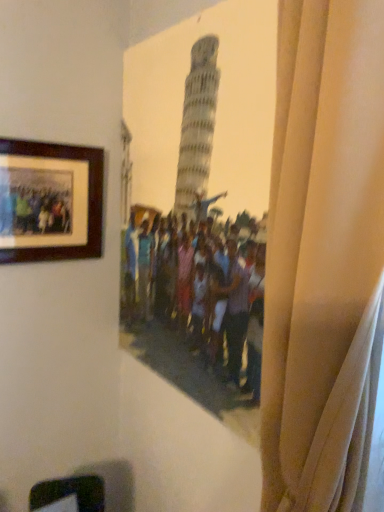
Question: Is beige fabric curtain at right inside the boundaries of wooden picture frame at upper left, or outside?

Choices:
 (A) outside
 (B) inside

Answer: (A)

Question: Looking at their shapes, would you say beige fabric curtain at right is wider or thinner than wooden picture frame at upper left?

Choices:
 (A) thin
 (B) wide

Answer: (B)

Question: Looking at the image, does beige fabric curtain at right seem bigger or smaller compared to wooden picture frame at upper left?

Choices:
 (A) small
 (B) big

Answer: (B)

Question: Choose the correct answer: Is wooden picture frame at upper left inside beige fabric curtain at right or outside it?

Choices:
 (A) outside
 (B) inside

Answer: (A)

Question: In terms of size, does wooden picture frame at upper left appear bigger or smaller than beige fabric curtain at right?

Choices:
 (A) small
 (B) big

Answer: (A)

Question: From the image's perspective, is wooden picture frame at upper left located above or below beige fabric curtain at right?

Choices:
 (A) below
 (B) above

Answer: (B)

Question: Is point (19, 211) closer or farther from the camera than point (326, 302)?

Choices:
 (A) farther
 (B) closer

Answer: (A)